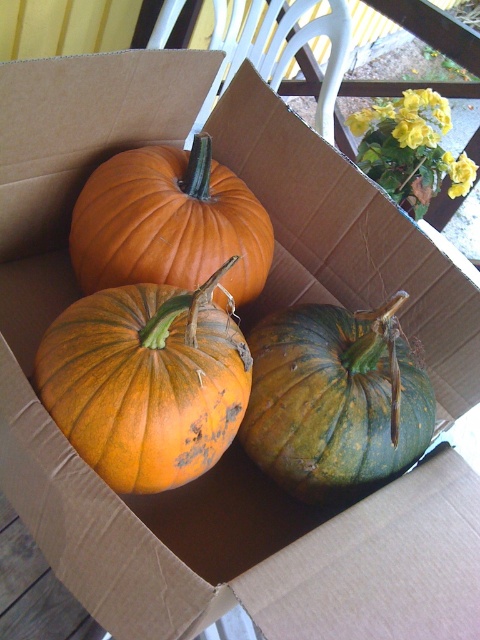
This screenshot has width=480, height=640. I want to click on orange matte pumpkin at center, so click(145, 381).

Where is `orange matte pumpkin at center`? Image resolution: width=480 pixels, height=640 pixels. orange matte pumpkin at center is located at coordinates (145, 381).

Locate an element on the screen. The width and height of the screenshot is (480, 640). orange matte pumpkin at center is located at coordinates (145, 381).

Can you confirm if green matte pumpkin at center is taller than orange matte pumpkin at upper left?

Yes, green matte pumpkin at center is taller than orange matte pumpkin at upper left.

Describe the element at coordinates (335, 400) in the screenshot. The width and height of the screenshot is (480, 640). I see `green matte pumpkin at center` at that location.

Where is `green matte pumpkin at center`? This screenshot has height=640, width=480. green matte pumpkin at center is located at coordinates (335, 400).

Does orange matte pumpkin at center appear on the left side of green matte pumpkin at center?

Correct, you'll find orange matte pumpkin at center to the left of green matte pumpkin at center.

Between point (180, 364) and point (364, 356), which one is positioned in front?

Point (180, 364) is in front.

Find the location of a particular element. Image resolution: width=480 pixels, height=640 pixels. orange matte pumpkin at center is located at coordinates pyautogui.click(x=145, y=381).